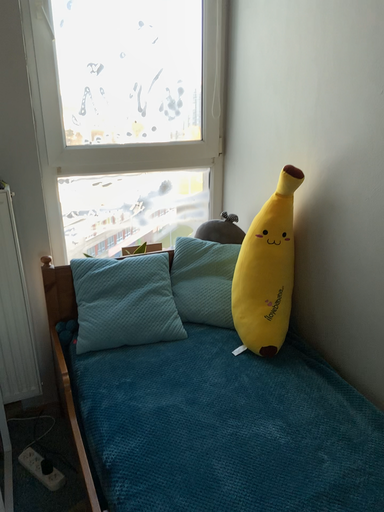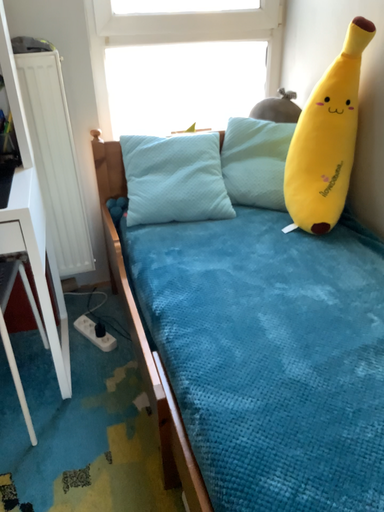
Question: How did the camera likely rotate when shooting the video?

Choices:
 (A) rotated upward
 (B) rotated downward

Answer: (B)